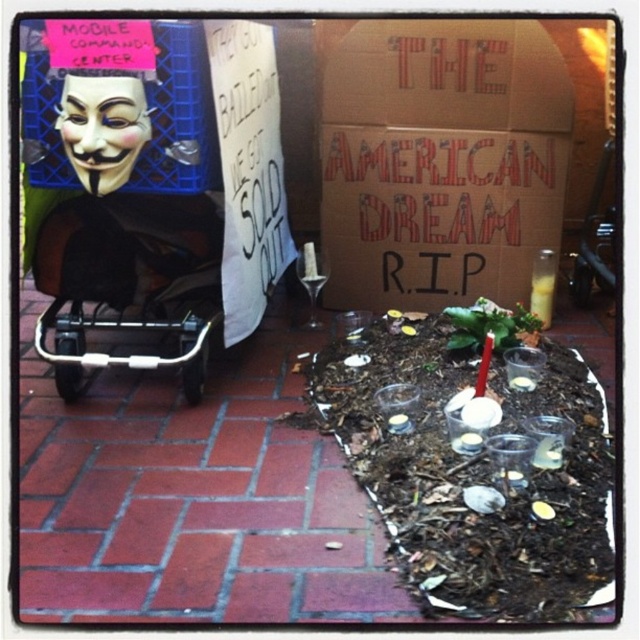
Between cardboard at center and metallic silver baby carriage at left, which one is positioned higher?

cardboard at center

Does cardboard at center appear on the right side of metallic silver baby carriage at left?

Indeed, cardboard at center is positioned on the right side of metallic silver baby carriage at left.

Between point (544, 67) and point (218, 300), which one is positioned behind?

Positioned behind is point (544, 67).

This screenshot has height=640, width=640. I want to click on cardboard at center, so click(x=440, y=160).

Looking at this image, between brown mulch at center and metallic silver baby carriage at left, which one appears on the right side from the viewer's perspective?

Positioned to the right is brown mulch at center.

Between brown mulch at center and metallic silver baby carriage at left, which one has less height?

Standing shorter between the two is metallic silver baby carriage at left.

Describe the element at coordinates (193, 499) in the screenshot. This screenshot has height=640, width=640. I see `brown mulch at center` at that location.

Where is `brown mulch at center`? The image size is (640, 640). brown mulch at center is located at coordinates 193,499.

Is brown mulch at center above cardboard at center?

No.

Is brown mulch at center further to the viewer compared to cardboard at center?

That is False.

Between point (212, 404) and point (378, 26), which one is positioned behind?

Positioned behind is point (378, 26).

Identify the location of brown mulch at center. (193, 499).